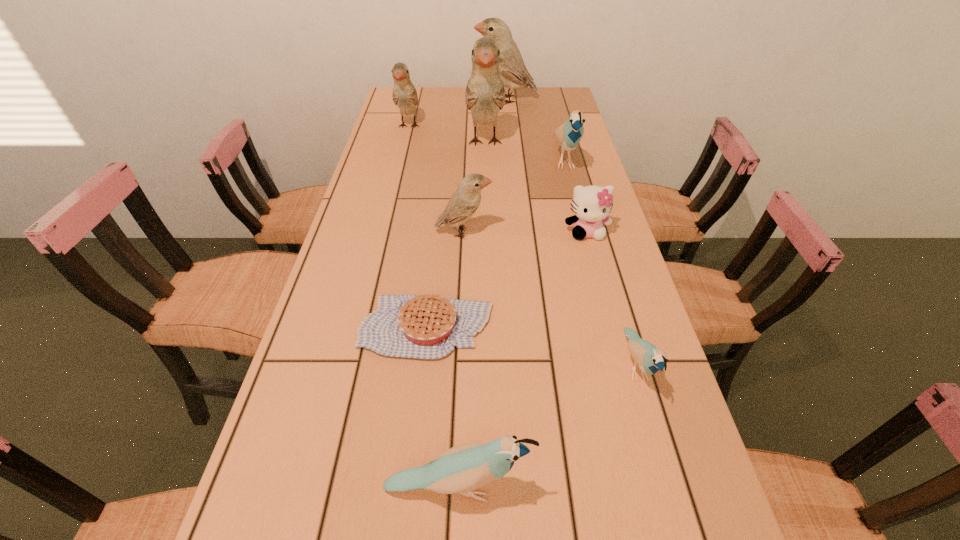
Where is `the leftmost blue bird`? The width and height of the screenshot is (960, 540). the leftmost blue bird is located at coordinates click(x=461, y=469).

Where is `kitten`? This screenshot has width=960, height=540. kitten is located at coordinates (591, 205).

Where is `the shortest bird`? The width and height of the screenshot is (960, 540). the shortest bird is located at coordinates (650, 359).

Find the location of a particular element. The width and height of the screenshot is (960, 540). the second farthest blue bird is located at coordinates (650, 359).

Where is `pie`? The width and height of the screenshot is (960, 540). pie is located at coordinates (427, 326).

Where is `the shortest object`? The image size is (960, 540). the shortest object is located at coordinates (427, 326).

The image size is (960, 540). I want to click on vacant space located 0.160m at the face of the tallest object, so tap(486, 195).

Identify the location of vacant space located 0.060m at the face of the farthest white bird. Image resolution: width=960 pixels, height=540 pixels. (459, 100).

The image size is (960, 540). In order to click on vacant space located at the face of the farthest white bird in this screenshot , I will do `click(429, 100)`.

Find the location of a particular element. The width and height of the screenshot is (960, 540). free space located 0.160m at the face of the farthest white bird is located at coordinates (435, 100).